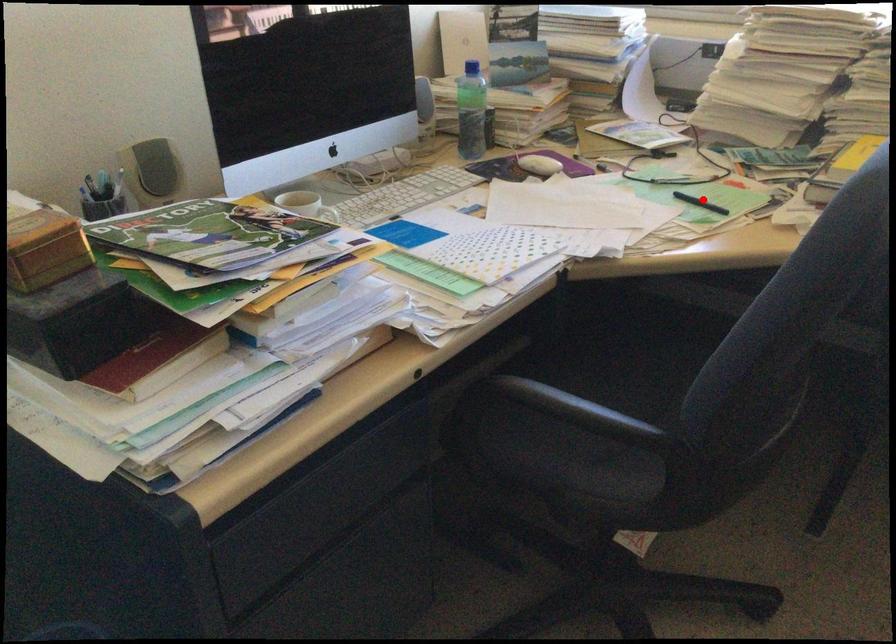
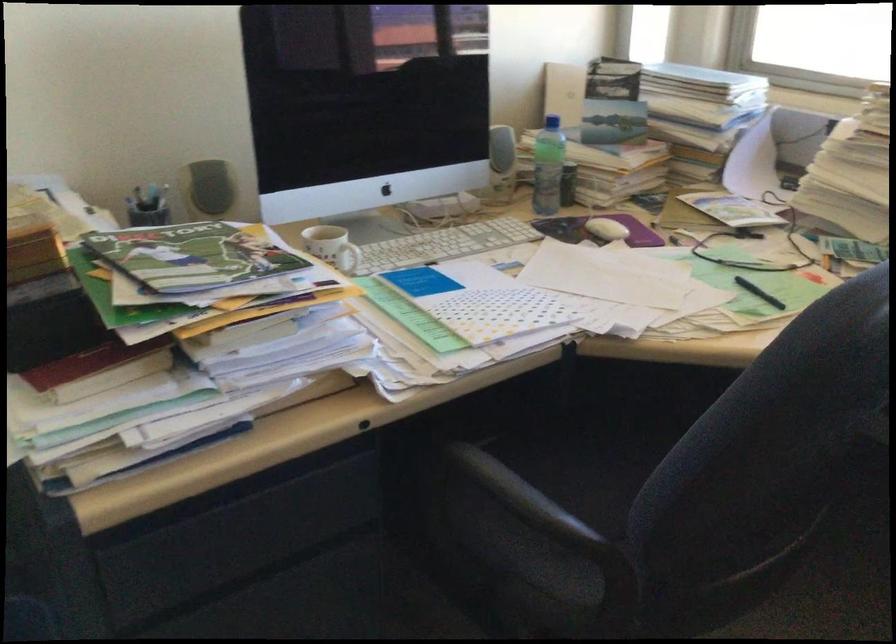
Question: I am providing you with two images of the same scene from different viewpoints. Image1 has a red point marked. In image2, the corresponding 3D location appears at what relative position? Reply with the corresponding letter.

Choices:
 (A) Closer
 (B) Farther

Answer: (A)